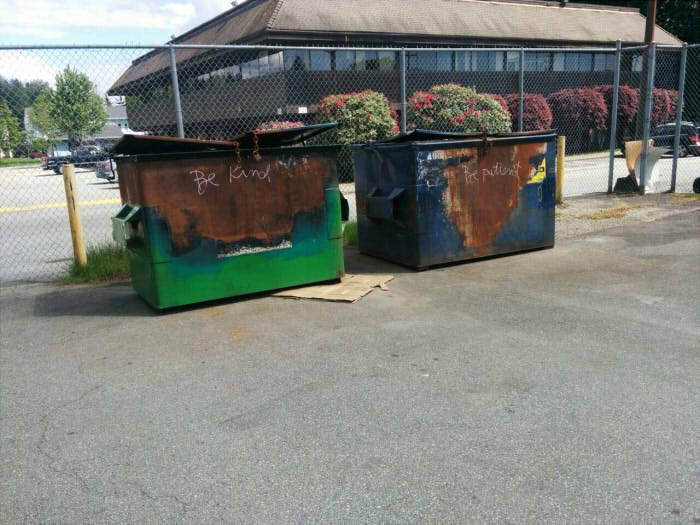
You are a GUI agent. You are given a task and a screenshot of the screen. Output one action in this format:
    pyautogui.click(x=<x>, y=<y>)
    Task: Click on the cardboard panel
    The width and height of the screenshot is (700, 525).
    Given the screenshot: What is the action you would take?
    pyautogui.click(x=337, y=289)